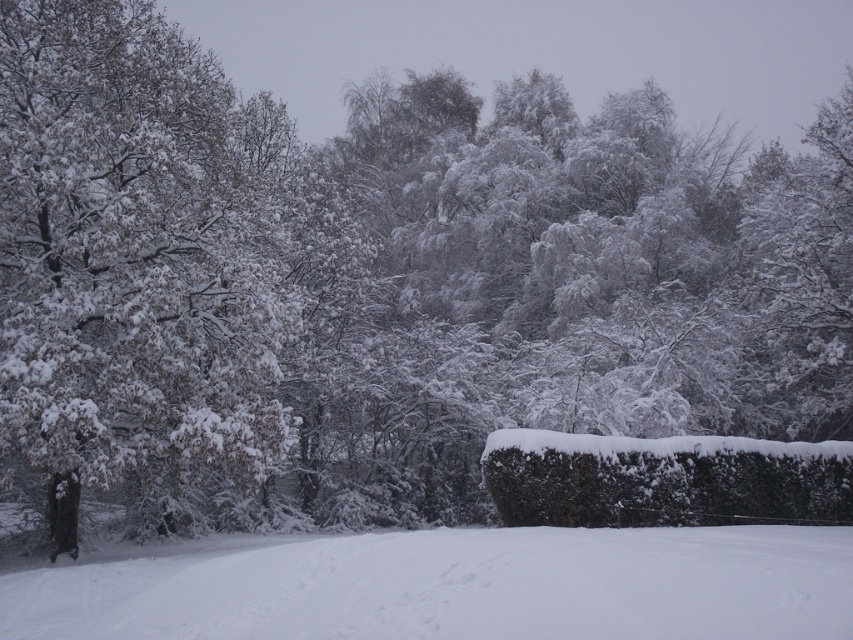
Is white fluffy snow at lower center taller than white frosty tree at upper right?

No.

Measure the distance between point [656,588] and camera.

A distance of 6.59 meters exists between point [656,588] and camera.

Is point (315, 570) less distant than point (822, 266)?

Yes, it is in front of point (822, 266).

Where is `white fluffy snow at lower center`? The image size is (853, 640). white fluffy snow at lower center is located at coordinates (457, 586).

Looking at this image, can you confirm if white snow-covered tree at left is wider than white fluffy snow at lower center?

No, white snow-covered tree at left is not wider than white fluffy snow at lower center.

Is white snow-covered tree at left smaller than white fluffy snow at lower center?

No, white snow-covered tree at left is not smaller than white fluffy snow at lower center.

Is point (195, 225) closer to viewer compared to point (254, 557)?

No, (195, 225) is further to viewer.

Find the location of a particular element. The height and width of the screenshot is (640, 853). white snow-covered tree at left is located at coordinates (129, 262).

Which of these two, white fluffy snow at lower center or green textured hedge at lower right, stands taller?

white fluffy snow at lower center is taller.

Between white fluffy snow at lower center and green textured hedge at lower right, which one is positioned lower?

white fluffy snow at lower center

Find the location of `white fluffy snow at lower center`. white fluffy snow at lower center is located at coordinates (457, 586).